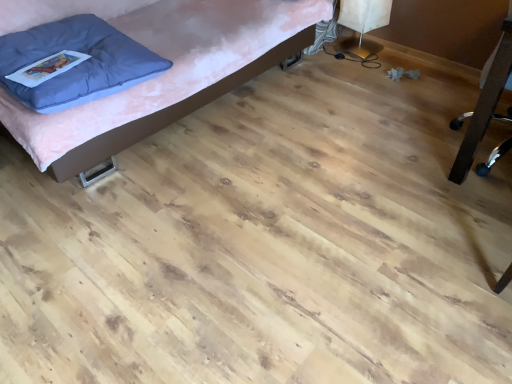
Find the location of a particular element. Image resolution: width=512 pixels, height=384 pixels. free space in front of matte pink bed at upper left, which is the second furniture in right-to-left order is located at coordinates (218, 237).